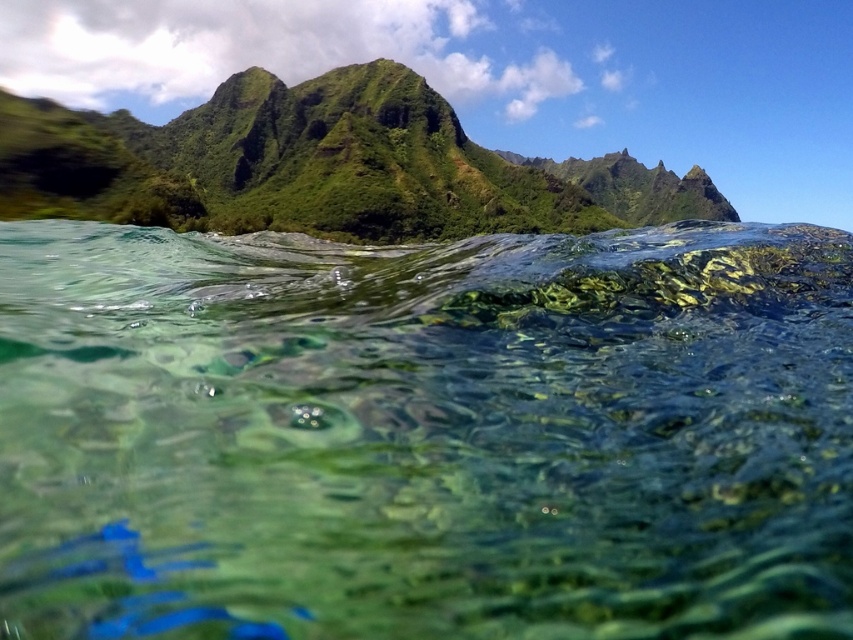
Question: Is clear glassy water at center further to camera compared to green grassy mountain at upper center?

Choices:
 (A) no
 (B) yes

Answer: (A)

Question: Among these points, which one is farthest from the camera?

Choices:
 (A) (608, 323)
 (B) (640, 209)

Answer: (B)

Question: Can you confirm if clear glassy water at center is positioned to the left of green grassy mountain at upper center?

Choices:
 (A) yes
 (B) no

Answer: (A)

Question: Is clear glassy water at center smaller than green grassy mountain at upper center?

Choices:
 (A) no
 (B) yes

Answer: (B)